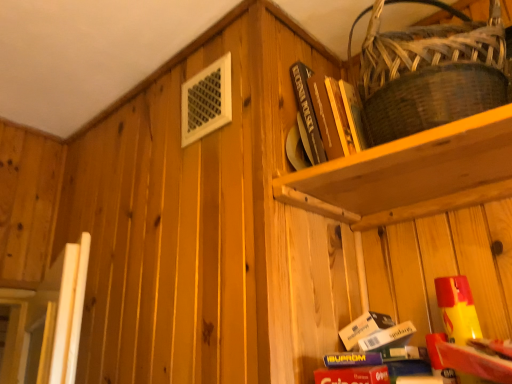
You are a GUI agent. You are given a task and a screenshot of the screen. Output one action in this format:
    pyautogui.click(x=<x>, y=<y>)
    Task: Click on the woven brown basket at upper right
    
    Given the screenshot: What is the action you would take?
    pyautogui.click(x=430, y=75)

What do you see at coordinates (430, 75) in the screenshot? The height and width of the screenshot is (384, 512). I see `woven brown basket at upper right` at bounding box center [430, 75].

Where is `woven brown basket at upper right`? This screenshot has width=512, height=384. woven brown basket at upper right is located at coordinates (430, 75).